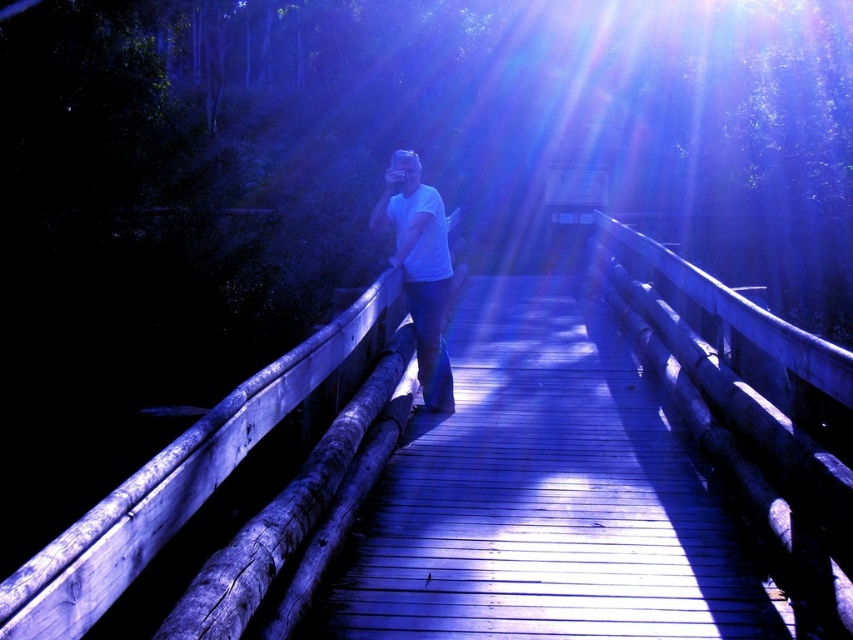
You are a photographer trying to capture the wooden bridge at center and the white matte shirt at center in a single shot. Based on their sizes, which object should you focus on first to ensure both are in frame?

The wooden bridge at center is shorter than the white matte shirt at center, so you should focus on the white matte shirt at center first to ensure both are in frame.

You are a photographer trying to capture the wooden bridge at center and the white matte shirt at center in the same frame. Based on their sizes in the image, which object would appear closer to the camera?

The white matte shirt at center appears closer to the camera since it is larger in size compared to the wooden bridge at center.